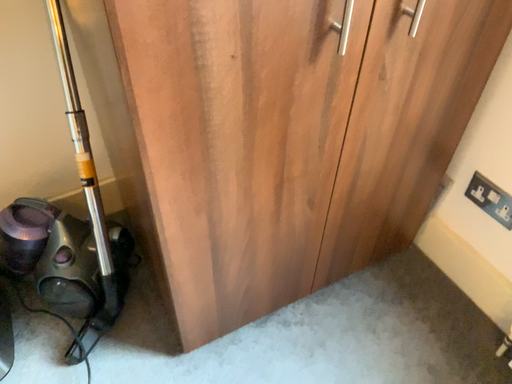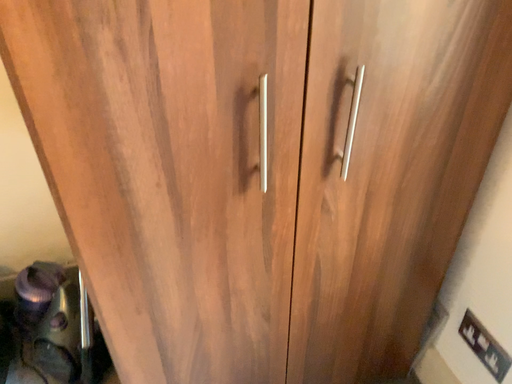
Question: Which way did the camera rotate in the video?

Choices:
 (A) rotated downward
 (B) rotated upward

Answer: (B)